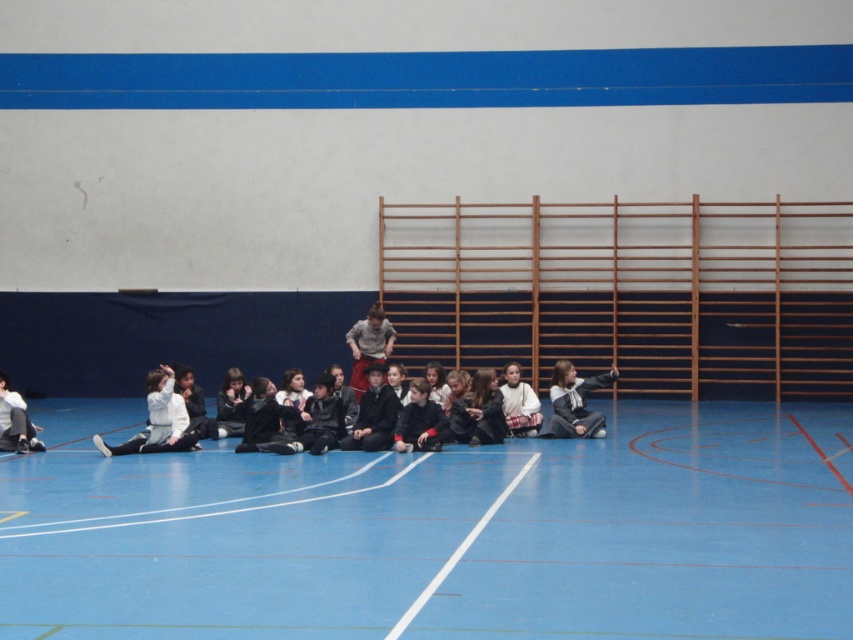
Who is more distant from viewer, [566,396] or [4,428]?

Positioned behind is point [566,396].

Based on the photo, which is above, black fabric jacket at lower right or dark gray sweater at lower left?

black fabric jacket at lower right

The width and height of the screenshot is (853, 640). Describe the element at coordinates (573, 403) in the screenshot. I see `black fabric jacket at lower right` at that location.

Locate an element on the screen. The height and width of the screenshot is (640, 853). black fabric jacket at lower right is located at coordinates (573, 403).

Is white matte jacket at lower left wider than black fabric jacket at lower right?

Yes, white matte jacket at lower left is wider than black fabric jacket at lower right.

At what (x,y) coordinates should I click in order to perform the action: click on white matte jacket at lower left. Please return your answer as a coordinate pair (x, y). This screenshot has height=640, width=853. Looking at the image, I should click on (157, 420).

Find the location of a particular element. The width and height of the screenshot is (853, 640). white matte jacket at lower left is located at coordinates (157, 420).

Does point (538, 509) come farther from viewer compared to point (178, 419)?

No, it is not.

Identify the location of blue rubber basketball court at lower center. Image resolution: width=853 pixels, height=640 pixels. (440, 532).